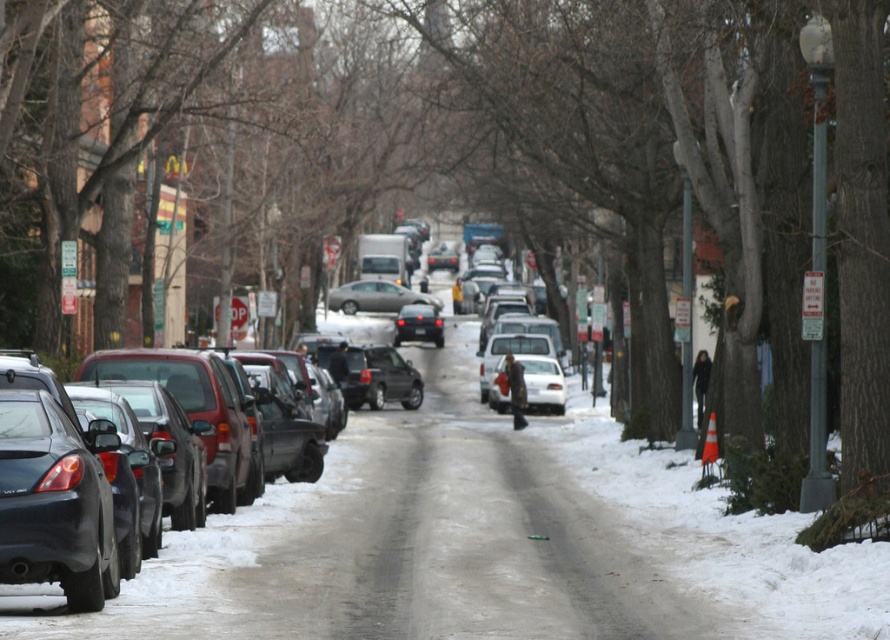
Question: Which object is closer to the camera taking this photo?

Choices:
 (A) satin silver sedan at center
 (B) matte black sedan at left

Answer: (B)

Question: Is matte black sedan at left below satin silver sedan at center?

Choices:
 (A) yes
 (B) no

Answer: (A)

Question: Can you confirm if matte black sedan at left is thinner than satin silver sedan at center?

Choices:
 (A) yes
 (B) no

Answer: (B)

Question: Can you confirm if matte black sedan at left is positioned to the right of satin silver sedan at center?

Choices:
 (A) no
 (B) yes

Answer: (B)